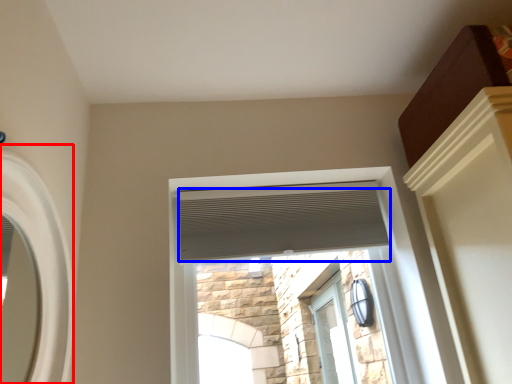
Question: Which point is closer to the camera, window (highlighted by a red box) or blind (highlighted by a blue box)?

Choices:
 (A) window
 (B) blind

Answer: (A)